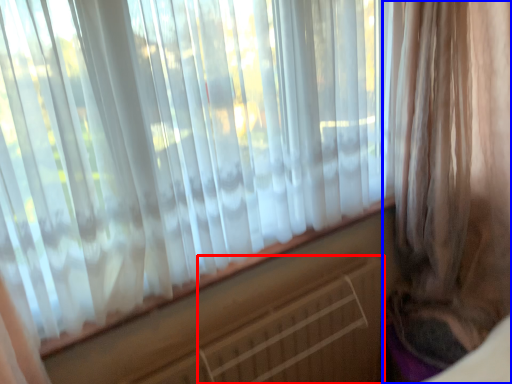
Question: Which object appears farthest to the camera in this image, radiator (highlighted by a red box) or curtain (highlighted by a blue box)?

Choices:
 (A) radiator
 (B) curtain

Answer: (A)